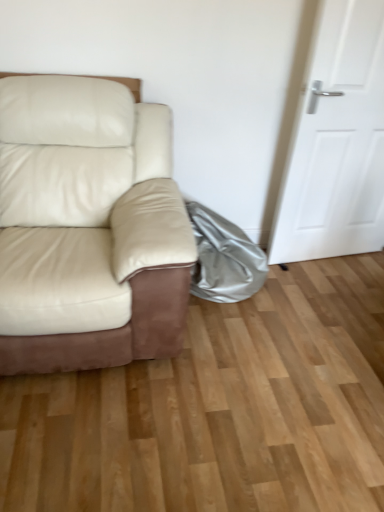
Locate an element on the screen. vacant area that lies between matte cream leather couch at left and shiny metallic bag at lower right is located at coordinates pos(228,323).